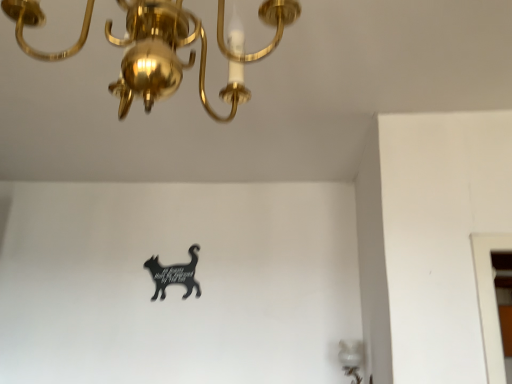
Question: Is black acrylic cat at center bigger or smaller than gold polished chandelier at upper left?

Choices:
 (A) big
 (B) small

Answer: (B)

Question: Considering the positions of black acrylic cat at center and gold polished chandelier at upper left in the image, is black acrylic cat at center wider or thinner than gold polished chandelier at upper left?

Choices:
 (A) thin
 (B) wide

Answer: (A)

Question: Would you say black acrylic cat at center is inside or outside gold polished chandelier at upper left?

Choices:
 (A) outside
 (B) inside

Answer: (A)

Question: Considering the positions of point (141, 91) and point (163, 278), is point (141, 91) closer or farther from the camera than point (163, 278)?

Choices:
 (A) closer
 (B) farther

Answer: (A)

Question: Considering the positions of gold polished chandelier at upper left and black acrylic cat at center in the image, is gold polished chandelier at upper left taller or shorter than black acrylic cat at center?

Choices:
 (A) tall
 (B) short

Answer: (A)

Question: Visually, is gold polished chandelier at upper left positioned to the left or to the right of black acrylic cat at center?

Choices:
 (A) left
 (B) right

Answer: (B)

Question: From a real-world perspective, is gold polished chandelier at upper left physically located above or below black acrylic cat at center?

Choices:
 (A) above
 (B) below

Answer: (A)